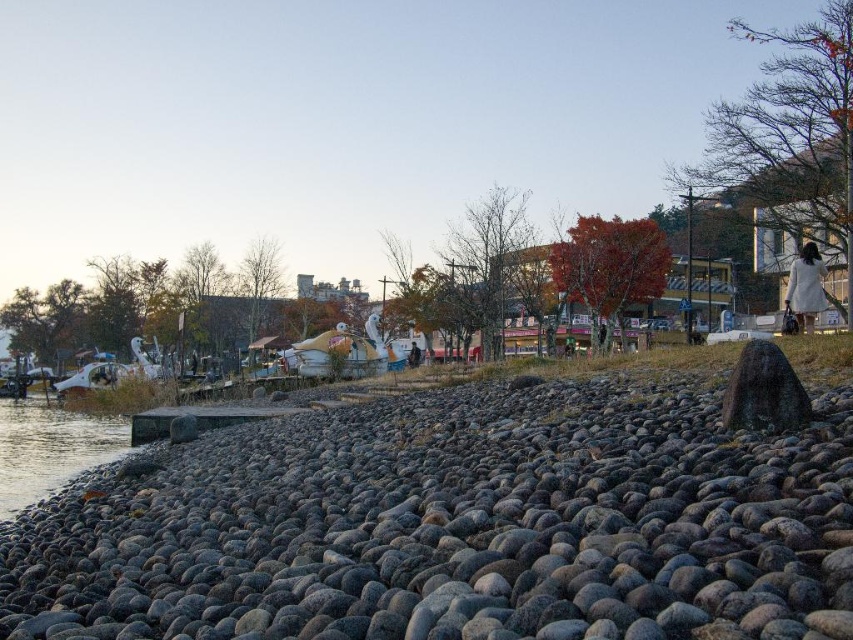
Question: Which is farther from the gray smooth rock at center?

Choices:
 (A) white cotton dress at right
 (B) clear water at lower left

Answer: (A)

Question: Considering the relative positions of gray smooth rock at center and white cotton dress at right in the image provided, where is gray smooth rock at center located with respect to white cotton dress at right?

Choices:
 (A) left
 (B) right

Answer: (A)

Question: In this image, where is gray smooth rock at center located relative to clear water at lower left?

Choices:
 (A) left
 (B) right

Answer: (B)

Question: Among these points, which one is nearest to the camera?

Choices:
 (A) (399, 563)
 (B) (20, 445)
 (C) (804, 257)

Answer: (A)

Question: Which point appears farthest from the camera in this image?

Choices:
 (A) (798, 278)
 (B) (56, 467)
 (C) (781, 529)

Answer: (B)

Question: Observing the image, what is the correct spatial positioning of gray smooth rock at center in reference to white cotton dress at right?

Choices:
 (A) below
 (B) above

Answer: (A)